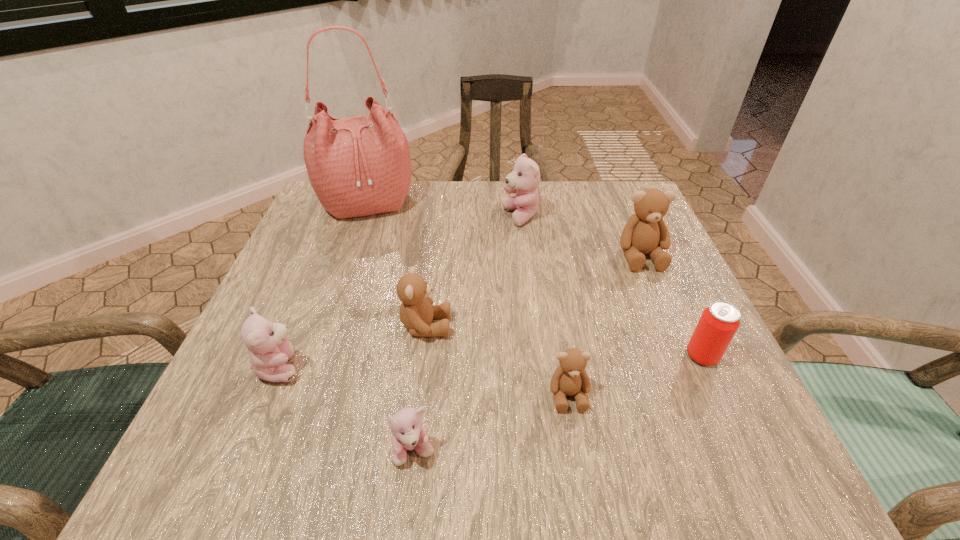
This screenshot has height=540, width=960. In order to click on handbag in this screenshot , I will do `click(358, 166)`.

In order to click on the biggest pink teddy bear in this screenshot , I will do `click(524, 180)`.

The width and height of the screenshot is (960, 540). I want to click on the rightmost pink teddy bear, so click(x=524, y=180).

The image size is (960, 540). I want to click on the farthest brown teddy bear, so click(645, 232).

You are a GUI agent. You are given a task and a screenshot of the screen. Output one action in this format:
    pyautogui.click(x=<x>, y=<y>)
    Task: Click on the rightmost brown teddy bear
    This screenshot has height=540, width=960.
    Given the screenshot: What is the action you would take?
    pyautogui.click(x=645, y=232)

Where is `the second smallest brown teddy bear`? This screenshot has width=960, height=540. the second smallest brown teddy bear is located at coordinates (416, 311).

Locate an element on the screen. The image size is (960, 540). the leftmost brown teddy bear is located at coordinates (416, 311).

The height and width of the screenshot is (540, 960). I want to click on the leftmost teddy bear, so click(269, 350).

Where is `the leftmost pink teddy bear`? This screenshot has height=540, width=960. the leftmost pink teddy bear is located at coordinates (269, 350).

The height and width of the screenshot is (540, 960). What are the coordinates of `red beer can` in the screenshot? It's located at (719, 322).